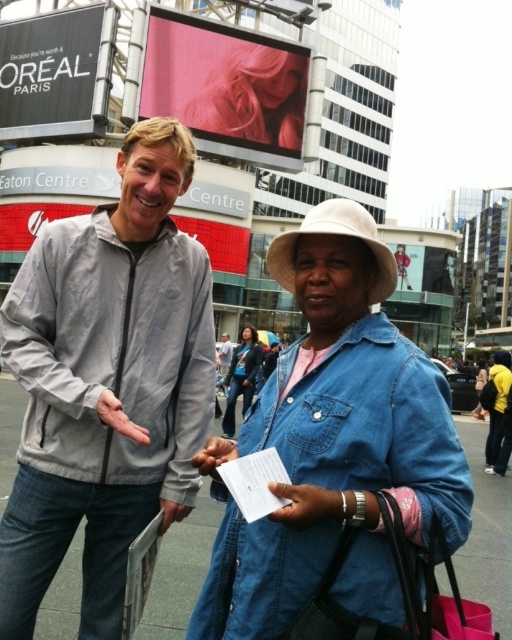
Is denim jacket at lower right smaller than denim jacket at center?

Incorrect, denim jacket at lower right is not smaller in size than denim jacket at center.

Between point (307, 484) and point (245, 328), which one is positioned in front?

Positioned in front is point (307, 484).

The height and width of the screenshot is (640, 512). Identify the location of denim jacket at lower right. (334, 444).

Is light gray zip-up jacket at center to the right of denim jacket at center from the viewer's perspective?

Incorrect, light gray zip-up jacket at center is not on the right side of denim jacket at center.

Is point (135, 512) positioned before point (256, 333)?

Yes, it is.

I want to click on light gray zip-up jacket at center, so click(x=106, y=384).

Based on the photo, who is positioned more to the right, light gray zip-up jacket at center or denim jacket at lower right?

From the viewer's perspective, denim jacket at lower right appears more on the right side.

Does point (91, 268) lie behind point (309, 467)?

Yes.

Identify the location of light gray zip-up jacket at center. (106, 384).